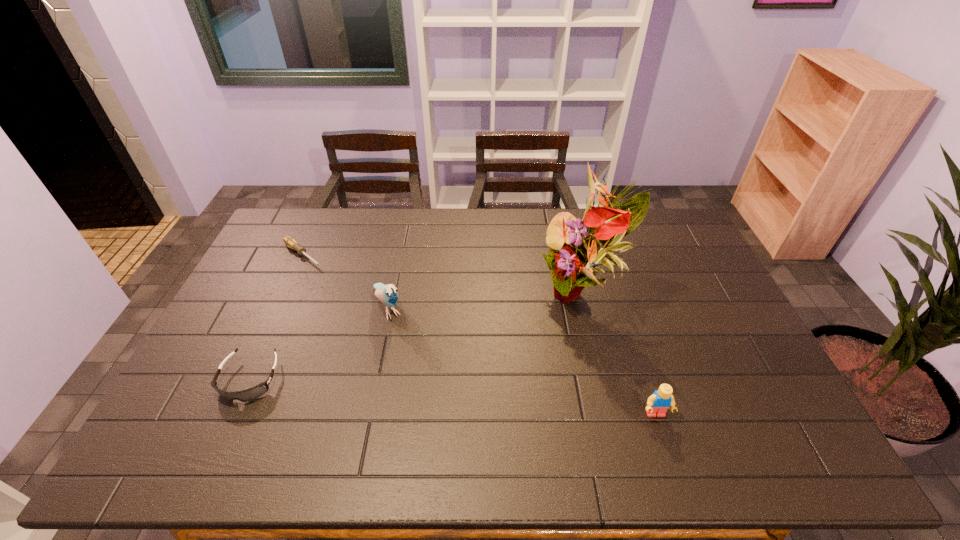
Where is `free space between the second shortest object and the tallest object`? This screenshot has height=540, width=960. free space between the second shortest object and the tallest object is located at coordinates (417, 336).

What are the coordinates of `free point between the second shortest object and the tallest object` in the screenshot? It's located at (417, 336).

The image size is (960, 540). In order to click on vacant point located between the tallest object and the fourth farthest object in this screenshot , I will do `click(417, 336)`.

Find the location of a particular element. free space between the second nearest object and the third object from right to left is located at coordinates (319, 343).

At what (x,y) coordinates should I click in order to perform the action: click on vacant space that's between the nearest object and the shortest object. Please return your answer as a coordinate pair (x, y). Looking at the image, I should click on (479, 335).

In order to click on free space between the second tallest object and the Lego in this screenshot , I will do `click(521, 361)`.

This screenshot has width=960, height=540. I want to click on free space between the third object from right to left and the nearest object, so click(x=521, y=361).

Identify the location of vacant area that lies between the bird and the Lego. The width and height of the screenshot is (960, 540). (521, 361).

Image resolution: width=960 pixels, height=540 pixels. I want to click on free space between the screwdriver and the nearest object, so click(x=479, y=335).

Find the location of a particular element. The height and width of the screenshot is (540, 960). object that can be found as the third closest to the bird is located at coordinates (575, 252).